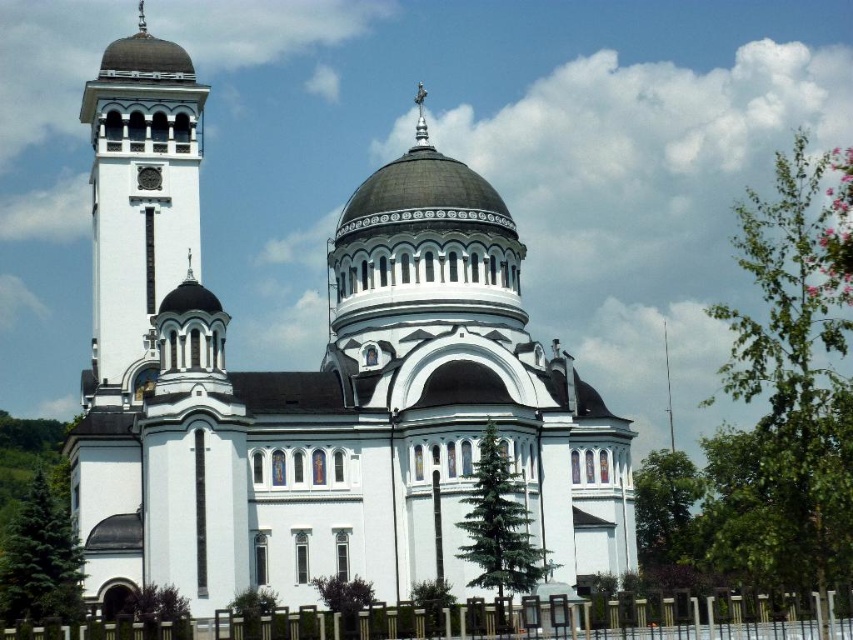
Based on the scene description, where is the white stone church at center located in terms of its 2D coordinates?

The white stone church at center is located at the 2D coordinates of point (316, 381).

You are standing in front of the church and want to walk towards the white metal fence at lower center. Which direction should you move relative to the white stone tower at left?

You should move to the right relative to the white stone tower at left because the white metal fence at lower center is to the right of the white stone tower at left.